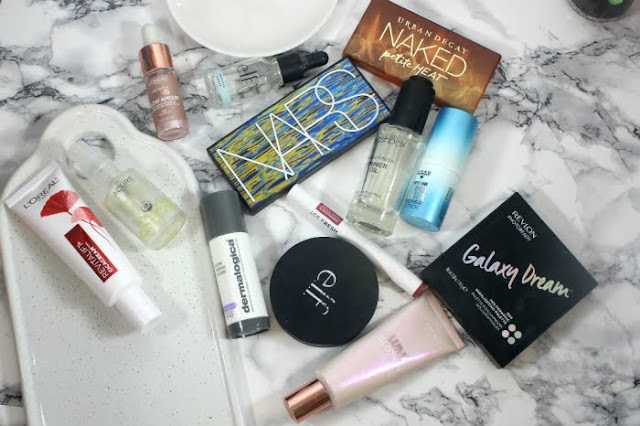
Where is `round container`? round container is located at coordinates (347, 306).